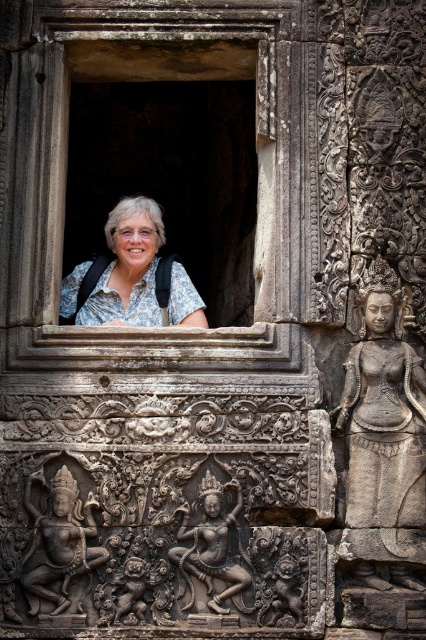
How much distance is there between stone window at center and white floral shirt at center?

They are 4.04 meters apart.

Is point (209, 77) behind point (152, 285)?

Yes, it is.

Locate an element on the screen. The image size is (426, 640). stone window at center is located at coordinates (169, 156).

Find the location of `white floral shirt at center`. white floral shirt at center is located at coordinates (134, 275).

Does white floral shirt at center appear over dark gray stone sculpture at lower left?

Indeed, white floral shirt at center is positioned over dark gray stone sculpture at lower left.

Does point (147, 212) come farther from viewer compared to point (58, 563)?

Yes.

This screenshot has width=426, height=640. What are the coordinates of `white floral shirt at center` in the screenshot? It's located at (134, 275).

Is point (368, 513) farther from viewer compared to point (77, 554)?

Yes, it is.

Is gray stone statue at right bigger than dark gray stone sculpture at lower left?

Yes, gray stone statue at right is bigger than dark gray stone sculpture at lower left.

The image size is (426, 640). I want to click on gray stone statue at right, so click(x=382, y=413).

The image size is (426, 640). Find the location of `gray stone statue at right`. gray stone statue at right is located at coordinates 382,413.